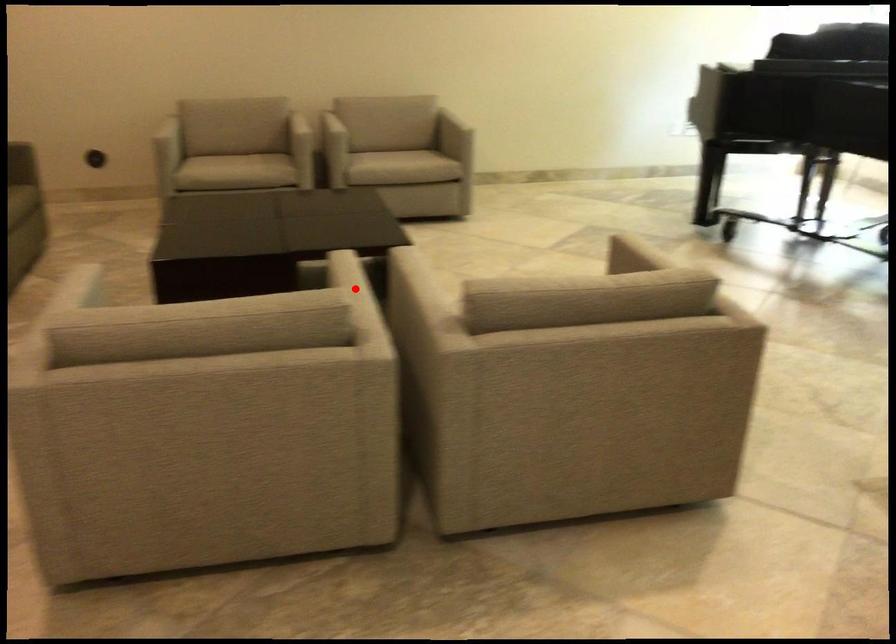
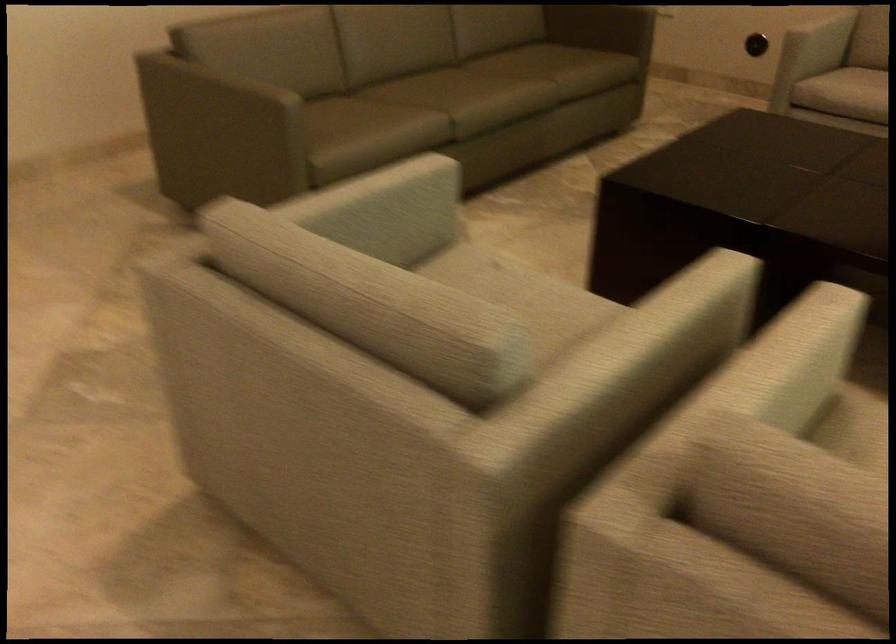
Question: A red point is marked in image1. In image2, is the corresponding 3D point closer to the camera or farther? Reply with the corresponding letter.

Choices:
 (A) The corresponding 3D point is closer.
 (B) The corresponding 3D point is farther.

Answer: (A)